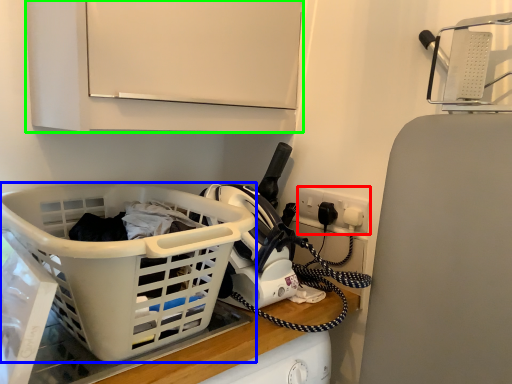
Question: Which object is the farthest from electric outlet (highlighted by a red box)? Choose among these: basket (highlighted by a blue box) or cabinetry (highlighted by a green box).

Choices:
 (A) basket
 (B) cabinetry

Answer: (A)